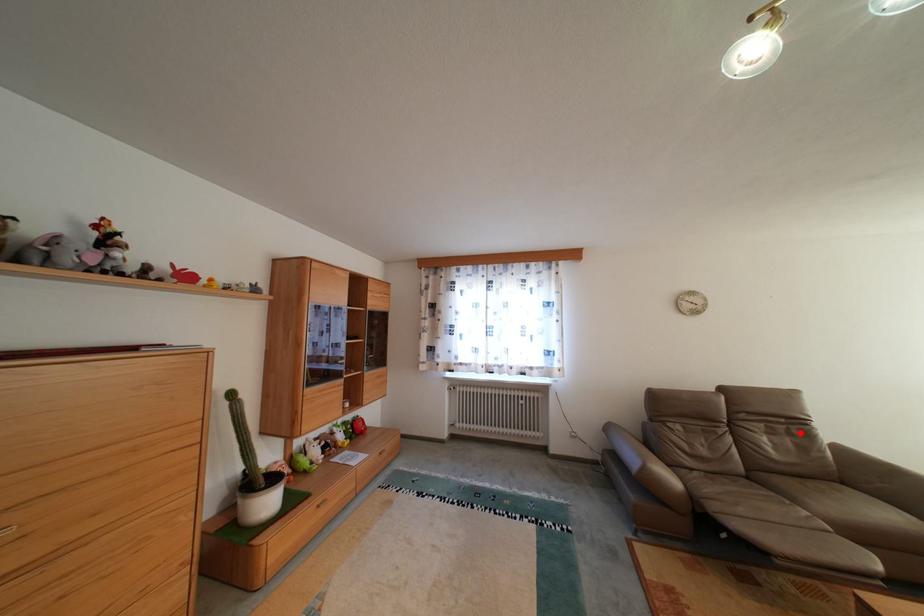
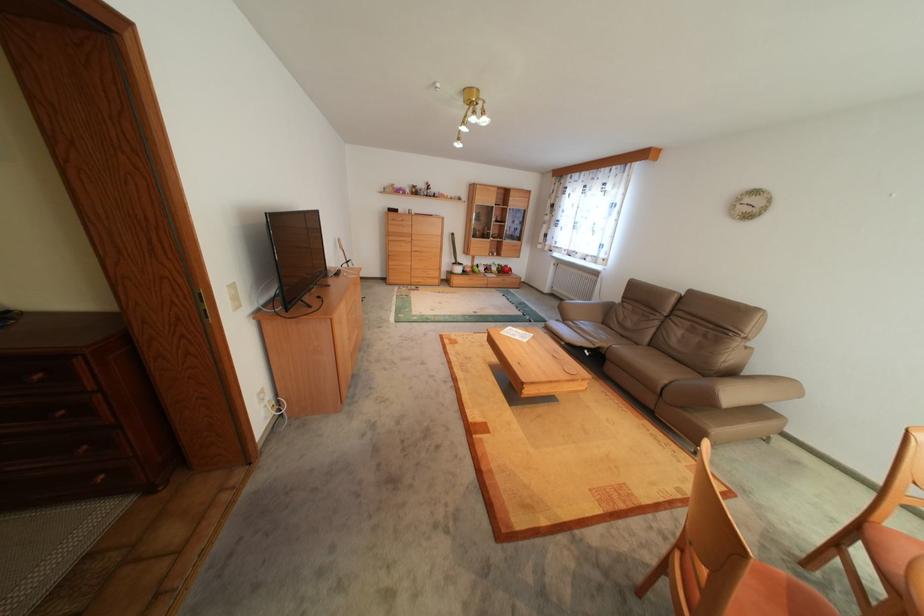
Question: I am providing you with two images of the same scene from different viewpoints. A red point is marked on the first image. Is the red point's position out of view in image 2?

Choices:
 (A) Yes
 (B) No

Answer: (B)